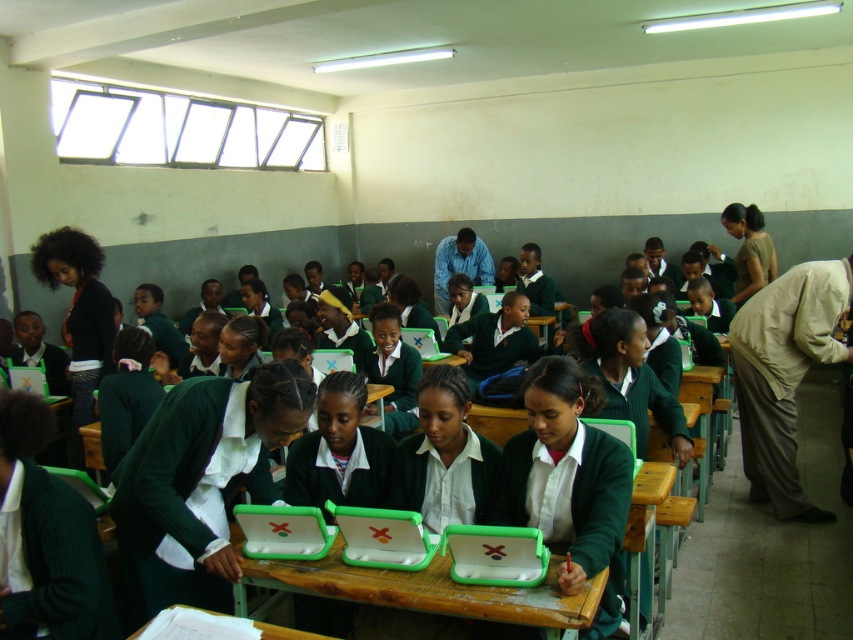
Question: Which point is farther from the camera taking this photo?

Choices:
 (A) (378, 595)
 (B) (325, 636)
 (C) (432, 330)

Answer: (C)

Question: Does green plastic laptops at center appear over green matte laptop at center?

Choices:
 (A) no
 (B) yes

Answer: (A)

Question: Which of the following is the closest to the observer?

Choices:
 (A) (402, 326)
 (B) (215, 612)
 (C) (583, 614)

Answer: (C)

Question: Is the position of green plastic laptops at center more distant than that of wooden desk at center?

Choices:
 (A) no
 (B) yes

Answer: (B)

Question: Can you confirm if wooden desk at center is bigger than green matte laptop at center?

Choices:
 (A) yes
 (B) no

Answer: (B)

Question: Among these points, which one is nearest to the camera?

Choices:
 (A) (421, 333)
 (B) (282, 628)

Answer: (B)